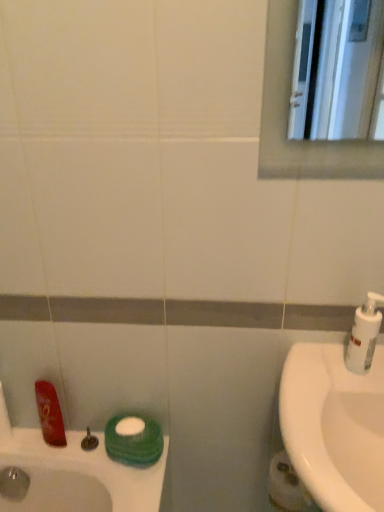
Question: Considering the relative positions of white matte toilet paper at lower right and white plastic soap dispenser at right in the image provided, is white matte toilet paper at lower right to the left or to the right of white plastic soap dispenser at right?

Choices:
 (A) right
 (B) left

Answer: (B)

Question: Looking at the image, does white matte toilet paper at lower right seem bigger or smaller compared to white plastic soap dispenser at right?

Choices:
 (A) big
 (B) small

Answer: (A)

Question: Which is nearer to the white glossy sink at right?

Choices:
 (A) white plastic soap dispenser at right
 (B) white matte toilet paper at lower right
 (C) matte silver faucet at lower left

Answer: (A)

Question: Estimate the real-world distances between objects in this image. Which object is farther from the matte silver faucet at lower left?

Choices:
 (A) white plastic soap dispenser at right
 (B) white glossy sink at right
 (C) white matte toilet paper at lower right

Answer: (A)